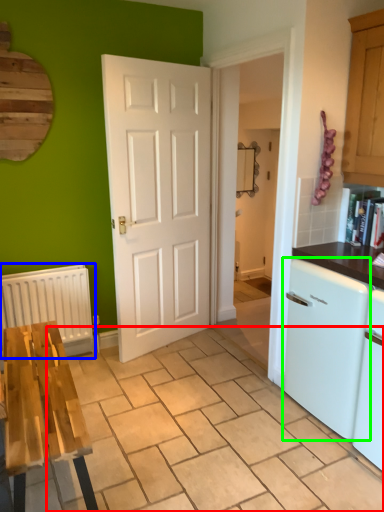
Question: Which is nearer to the tile (highlighted by a red box)? radiator (highlighted by a blue box) or dish washer (highlighted by a green box).

Choices:
 (A) radiator
 (B) dish washer

Answer: (B)